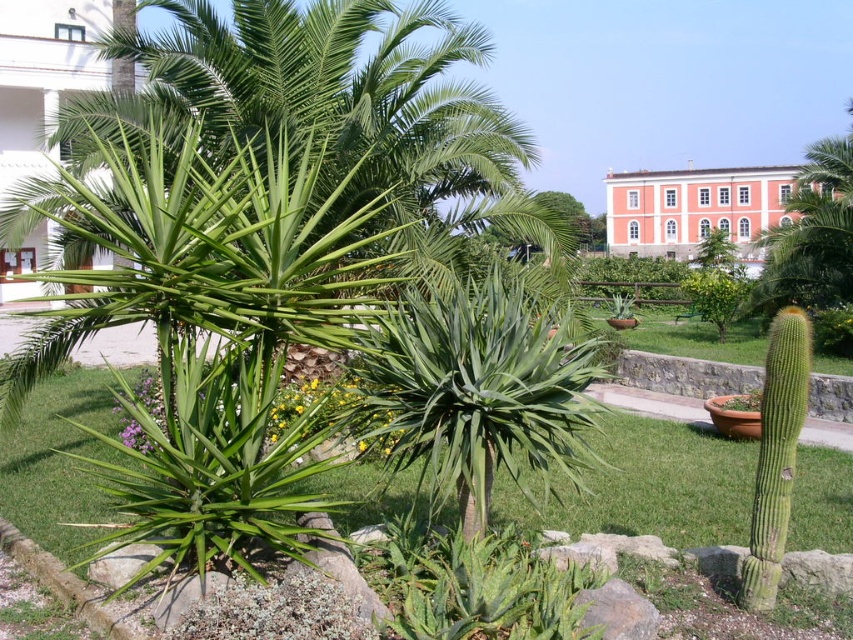
Question: Which object appears closest to the camera in this image?

Choices:
 (A) pink stucco building at upper center
 (B) green leafy palm tree at center

Answer: (B)

Question: Observing the image, what is the correct spatial positioning of green leafy palm tree at center in reference to pink stucco building at upper center?

Choices:
 (A) left
 (B) right

Answer: (A)

Question: Is green leafy palm tree at center above pink stucco building at upper center?

Choices:
 (A) yes
 (B) no

Answer: (B)

Question: Which object is closer to the camera taking this photo?

Choices:
 (A) green leafy palm tree at center
 (B) pink stucco building at upper center

Answer: (A)

Question: Does green leafy palm tree at center appear on the right side of pink stucco building at upper center?

Choices:
 (A) no
 (B) yes

Answer: (A)